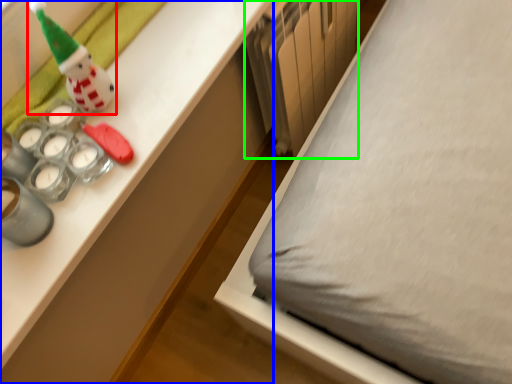
Question: Which is nearer to the toy (highlighted by a red box)? desk (highlighted by a blue box) or radiator (highlighted by a green box).

Choices:
 (A) desk
 (B) radiator

Answer: (A)